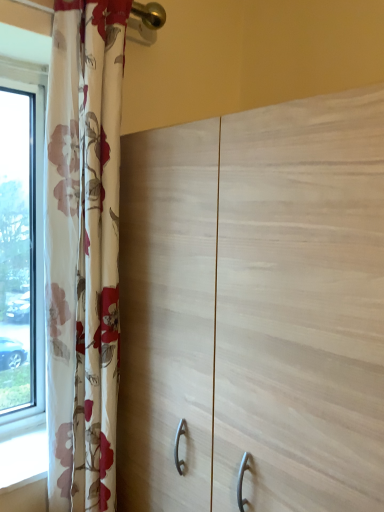
Describe the element at coordinates (255, 309) in the screenshot. I see `light wood cupboard at center` at that location.

The width and height of the screenshot is (384, 512). Find the location of `light wood cupboard at center`. light wood cupboard at center is located at coordinates (255, 309).

Measure the distance between point (72, 322) and camera.

Point (72, 322) is 36.34 inches away from camera.

What do you see at coordinates (83, 251) in the screenshot? I see `floral fabric curtain at left` at bounding box center [83, 251].

Locate an element on the screen. floral fabric curtain at left is located at coordinates (83, 251).

In order to click on light wood cupboard at center in this screenshot , I will do `click(255, 309)`.

Does floral fabric curtain at left appear on the right side of light wood cupboard at center?

In fact, floral fabric curtain at left is to the left of light wood cupboard at center.

Is the depth of floral fabric curtain at left less than that of light wood cupboard at center?

That is False.

Considering the points (60, 380) and (283, 379), which point is in front, point (60, 380) or point (283, 379)?

Positioned in front is point (283, 379).

From the image's perspective, which one is positioned higher, floral fabric curtain at left or light wood cupboard at center?

floral fabric curtain at left.

From the picture: From a real-world perspective, which object rests below the other?

light wood cupboard at center.

Between floral fabric curtain at left and light wood cupboard at center, which one has smaller width?

floral fabric curtain at left is thinner.

Does floral fabric curtain at left have a greater height compared to light wood cupboard at center?

Yes, floral fabric curtain at left is taller than light wood cupboard at center.

Does floral fabric curtain at left have a larger size compared to light wood cupboard at center?

No, floral fabric curtain at left is not bigger than light wood cupboard at center.

Which is correct: floral fabric curtain at left is inside light wood cupboard at center, or outside of it?

floral fabric curtain at left is not inside light wood cupboard at center, it's outside.

Is floral fabric curtain at left not near light wood cupboard at center?

No, floral fabric curtain at left is not far away from light wood cupboard at center.

Is floral fabric curtain at left looking in the opposite direction of light wood cupboard at center?

No, floral fabric curtain at left is not facing the opposite direction of light wood cupboard at center.

What's the angular difference between floral fabric curtain at left and light wood cupboard at center's facing directions?

The facing directions of floral fabric curtain at left and light wood cupboard at center are 90 degrees apart.

This screenshot has width=384, height=512. I want to click on cupboard in front of the floral fabric curtain at left, so coord(255,309).

Which is more to the right, light wood cupboard at center or floral fabric curtain at left?

From the viewer's perspective, light wood cupboard at center appears more on the right side.

Which object is more forward, light wood cupboard at center or floral fabric curtain at left?

light wood cupboard at center.

Which point is more forward, (148, 484) or (107, 382)?

The point (107, 382) is in front.

From the image's perspective, is light wood cupboard at center beneath floral fabric curtain at left?

Correct, light wood cupboard at center appears lower than floral fabric curtain at left in the image.

Looking at this image, from a real-world perspective, is light wood cupboard at center on top of floral fabric curtain at left?

Actually, light wood cupboard at center is physically below floral fabric curtain at left in the real world.

Considering the sizes of objects light wood cupboard at center and floral fabric curtain at left in the image provided, who is thinner, light wood cupboard at center or floral fabric curtain at left?

Thinner between the two is floral fabric curtain at left.

Looking at this image, which of these two, light wood cupboard at center or floral fabric curtain at left, stands taller?

With more height is floral fabric curtain at left.

Who is smaller, light wood cupboard at center or floral fabric curtain at left?

floral fabric curtain at left is smaller.

In the scene shown: Would you say light wood cupboard at center is inside or outside floral fabric curtain at left?

The correct answer is: outside.

Is light wood cupboard at center not close to floral fabric curtain at left?

That's not correct — light wood cupboard at center is a little close to floral fabric curtain at left.

Is light wood cupboard at center facing away from floral fabric curtain at left?

light wood cupboard at center does not have its back to floral fabric curtain at left.

Find the location of a particular element. cupboard lying on the right of floral fabric curtain at left is located at coordinates (255, 309).

At what (x,y) coordinates should I click in order to perform the action: click on curtain that is above the light wood cupboard at center (from the image's perspective). Please return your answer as a coordinate pair (x, y). Looking at the image, I should click on (83, 251).

Where is `curtain above the light wood cupboard at center (from a real-world perspective)`? curtain above the light wood cupboard at center (from a real-world perspective) is located at coordinates (83, 251).